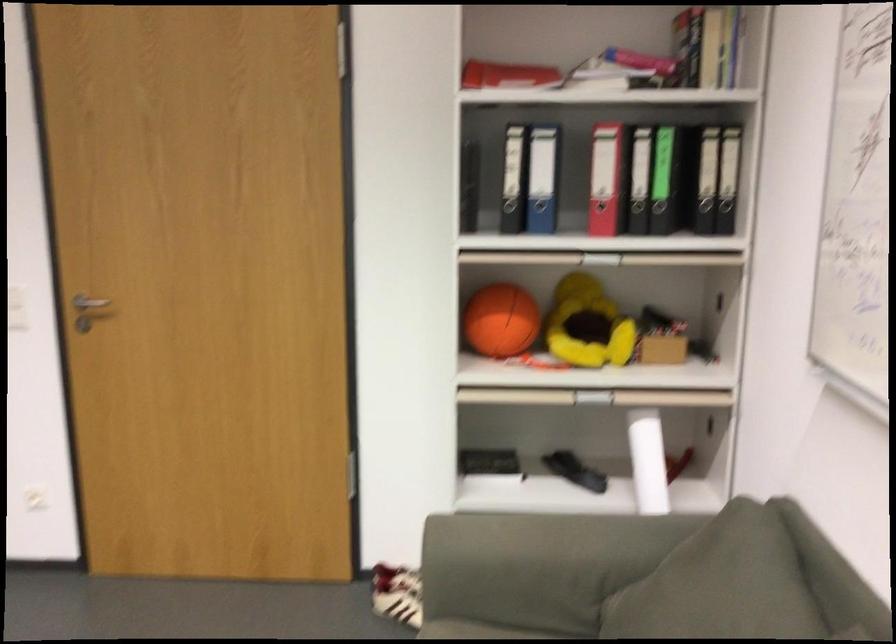
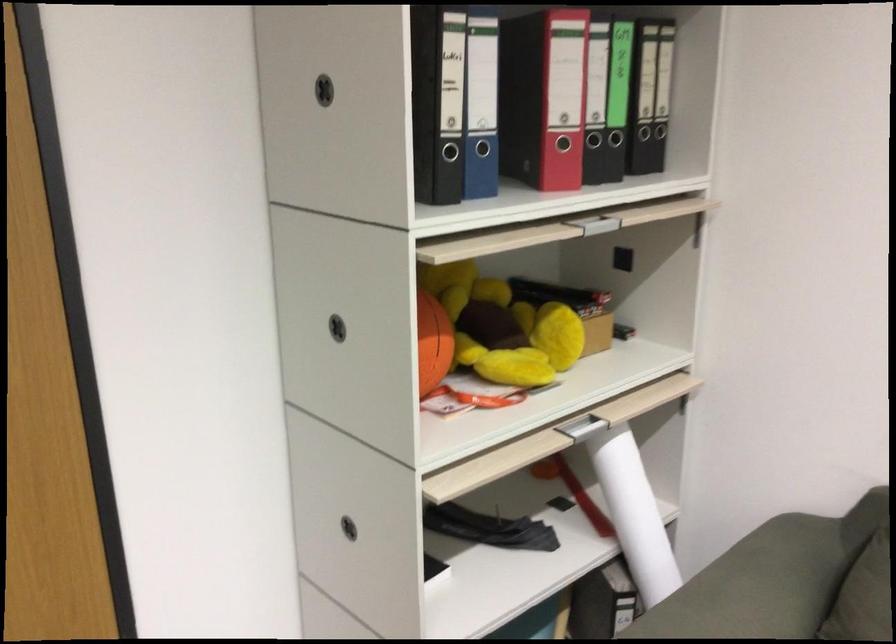
Find the pixel in the second image that matches pixel 601 251 in the first image.

(573, 219)